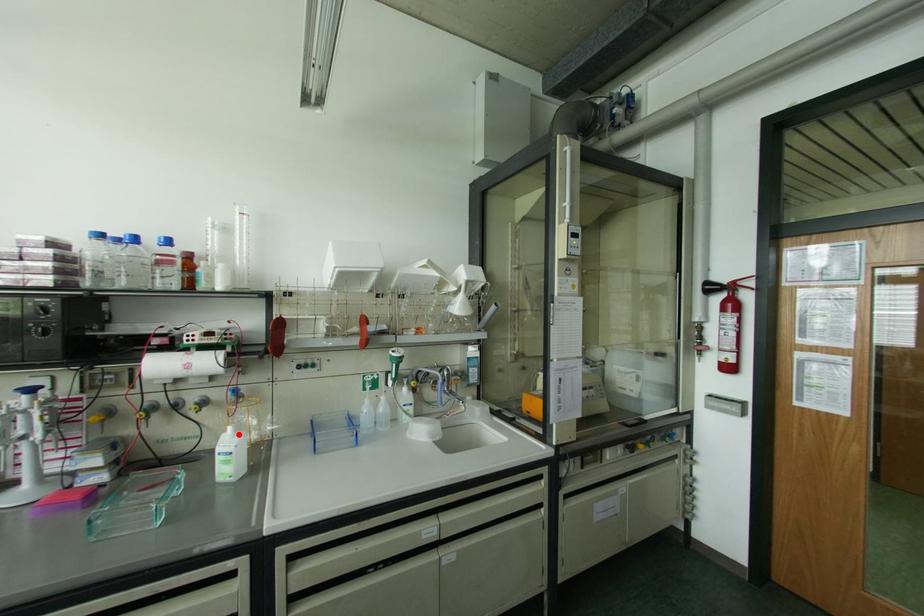
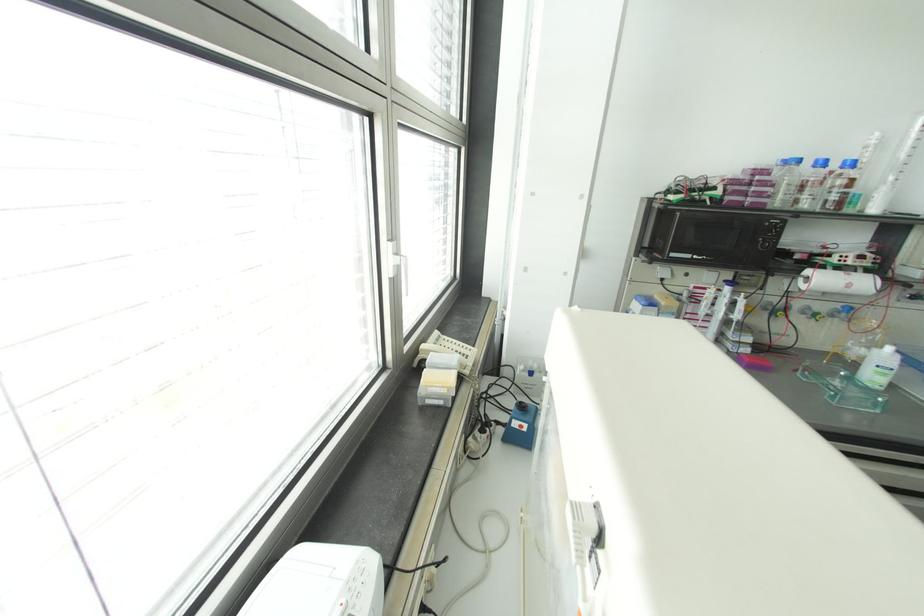
Where in the second image is the point corresponding to the highlighted location from the first image?

(898, 355)